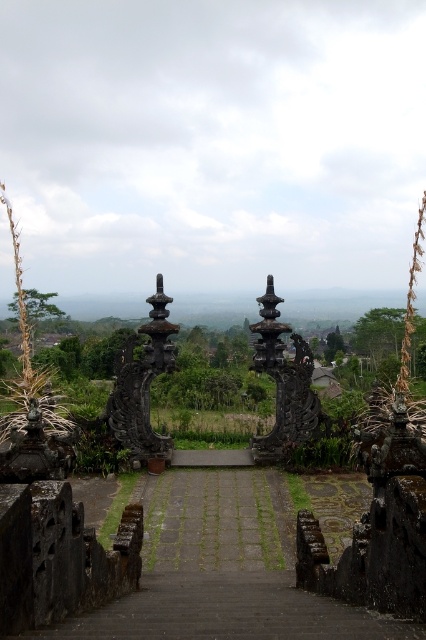
Question: Which of the following is the farthest from the observer?

Choices:
 (A) (250, 552)
 (B) (262, 328)

Answer: (B)

Question: Which object is farther from the camera taking this photo?

Choices:
 (A) black stone pillar at center
 (B) dark stone stairs at center

Answer: (A)

Question: Does dark stone stairs at center have a larger size compared to black stone pillar at center?

Choices:
 (A) yes
 (B) no

Answer: (A)

Question: Which object appears closest to the camera in this image?

Choices:
 (A) dark stone stairs at center
 (B) black stone pillar at center

Answer: (A)

Question: Is the position of dark stone stairs at center less distant than that of black stone pillar at center?

Choices:
 (A) no
 (B) yes

Answer: (B)

Question: Does dark stone stairs at center appear on the right side of black stone pillar at center?

Choices:
 (A) no
 (B) yes

Answer: (A)